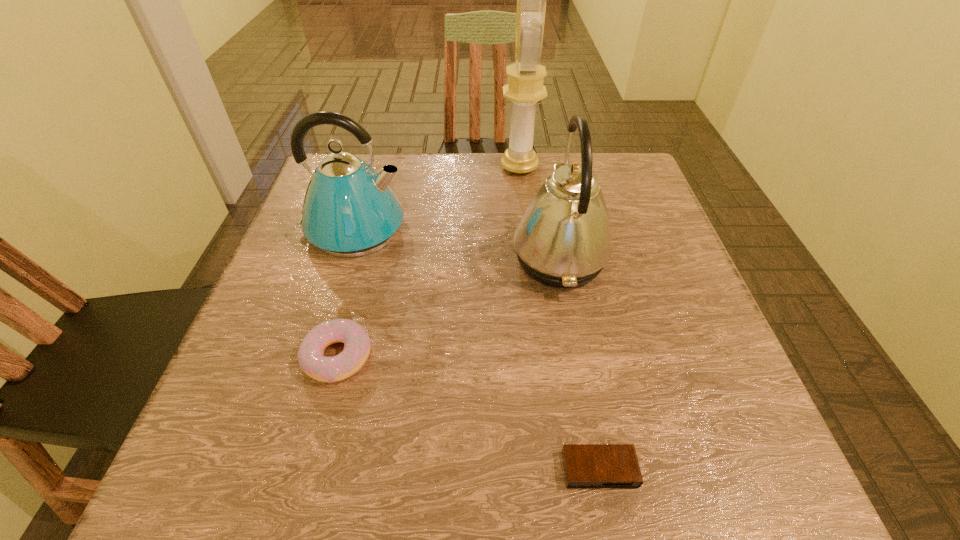
Locate an element on the screen. doughnut at the left edge is located at coordinates (310, 355).

This screenshot has width=960, height=540. I want to click on object that is at the right edge, so click(x=563, y=240).

Where is `object that is positioned at the far left corner`? object that is positioned at the far left corner is located at coordinates (349, 210).

Image resolution: width=960 pixels, height=540 pixels. In the image, there is a desktop. What are the coordinates of `vacant region at the far edge` in the screenshot? It's located at (440, 169).

At what (x,y) coordinates should I click in order to perform the action: click on vacant space at the near edge. Please return your answer as a coordinate pair (x, y). This screenshot has width=960, height=540. Looking at the image, I should click on (339, 460).

At what (x,y) coordinates should I click in order to perform the action: click on free region at the left edge of the desktop. Please return your answer as a coordinate pair (x, y). The width and height of the screenshot is (960, 540). Looking at the image, I should click on (300, 321).

This screenshot has height=540, width=960. What are the coordinates of `blank space at the right edge` in the screenshot? It's located at (634, 288).

Where is `vacant space that's between the right kettle and the alarm clock`? vacant space that's between the right kettle and the alarm clock is located at coordinates (579, 364).

You are a GUI agent. You are given a task and a screenshot of the screen. Output one action in this format:
    pyautogui.click(x=<x>, y=<y>)
    Task: Click on the free space between the second nearest object and the alarm clock
    
    Given the screenshot: What is the action you would take?
    pyautogui.click(x=468, y=413)

Locate an element on the screen. The image size is (960, 540). vacant area between the nearest object and the left kettle is located at coordinates (476, 349).